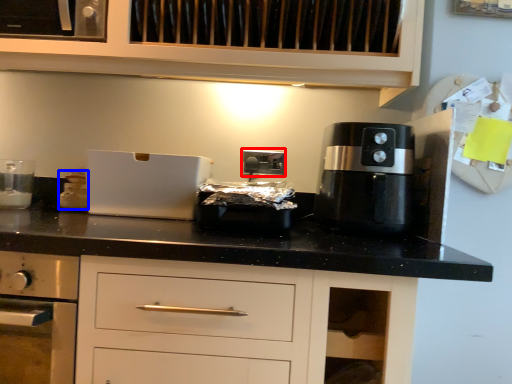
Question: Among these objects, which one is farthest to the camera, electric outlet (highlighted by a red box) or kitchen appliance (highlighted by a blue box)?

Choices:
 (A) electric outlet
 (B) kitchen appliance

Answer: (A)